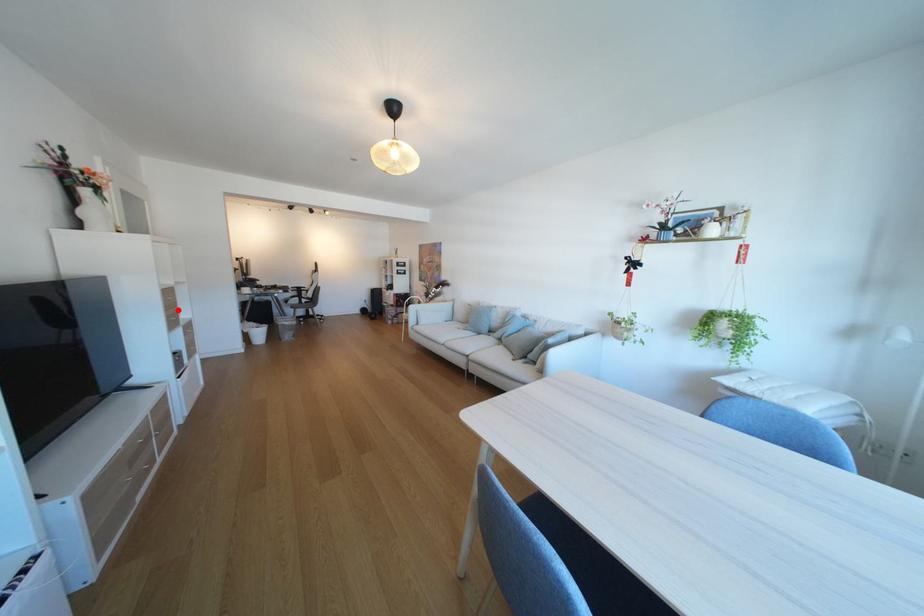
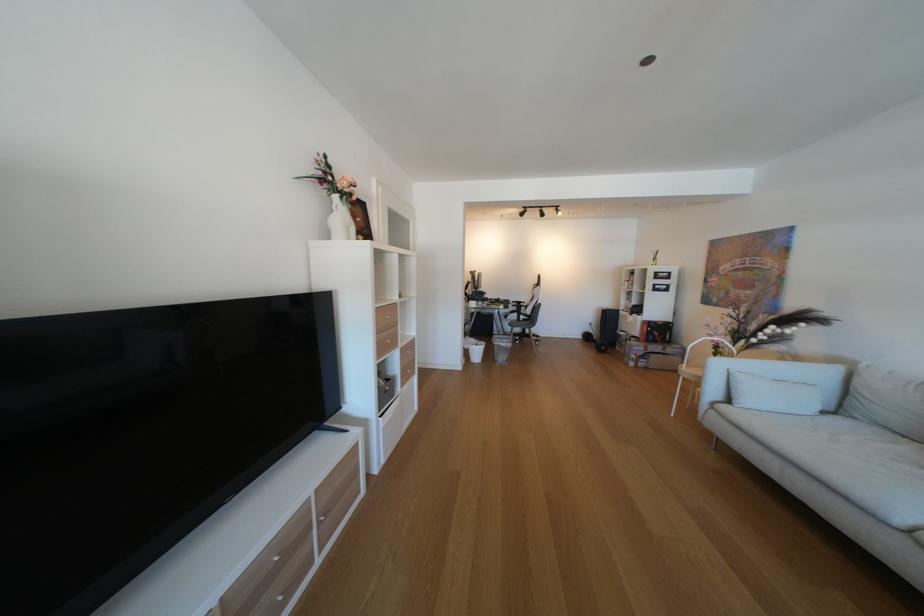
Question: I am providing you with two images of the same scene from different viewpoints. Given a red point in image1, look at the same physical point in image2. Is it:

Choices:
 (A) Closer to the viewpoint
 (B) Farther from the viewpoint

Answer: (B)